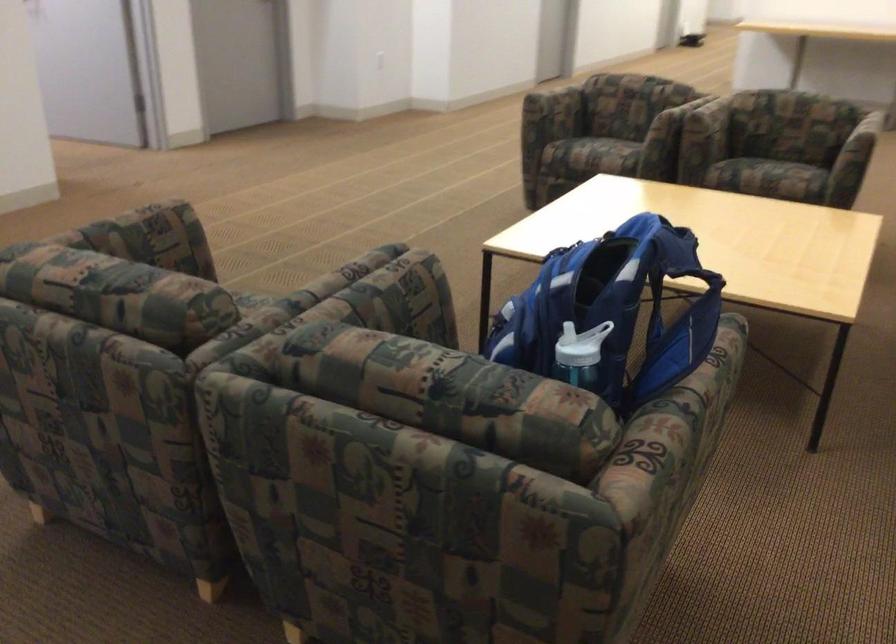
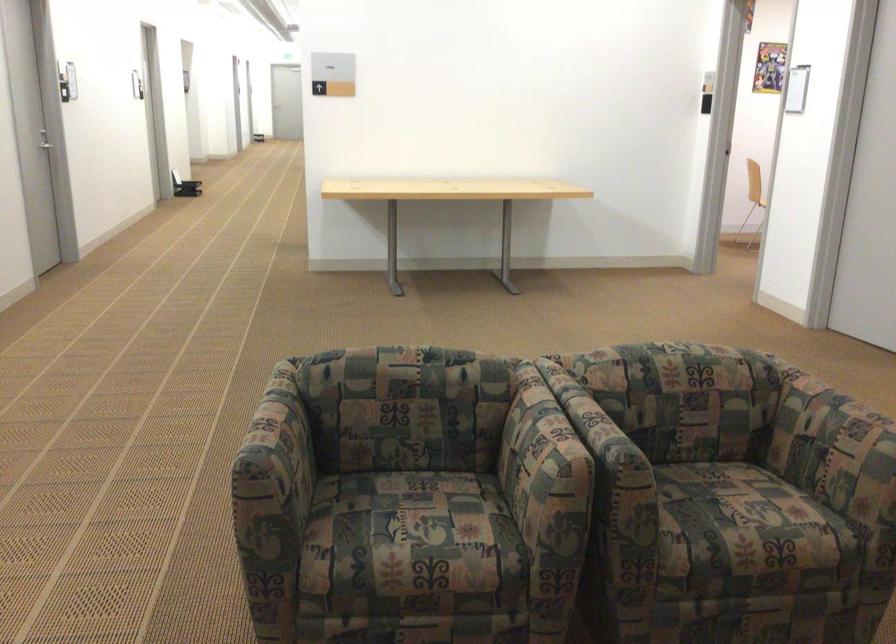
Locate, in the second image, the point that corresponds to the point at 692,93 in the first image.

(595, 427)